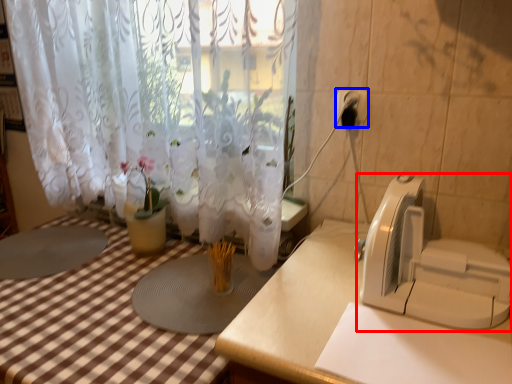
Question: Which object is closer to the camera taking this photo, appliance (highlighted by a red box) or electric outlet (highlighted by a blue box)?

Choices:
 (A) appliance
 (B) electric outlet

Answer: (A)